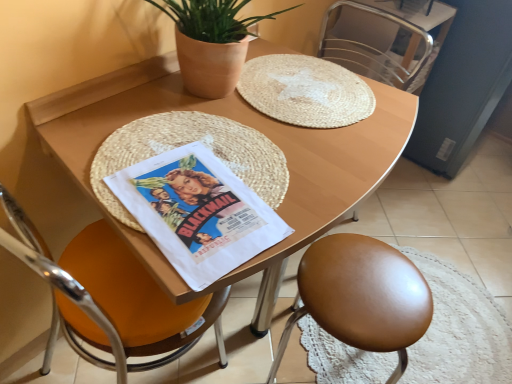
Identify the location of vacant point to the right of terracotta pot at upper center. The height and width of the screenshot is (384, 512). (307, 107).